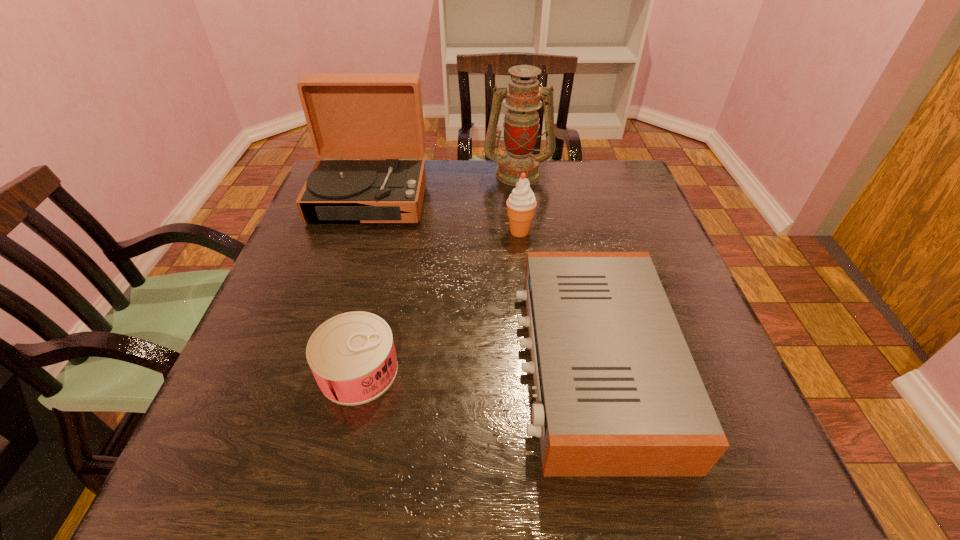
Image resolution: width=960 pixels, height=540 pixels. In order to click on free space located on the control panel of the radio receiver in this screenshot , I will do `click(427, 364)`.

Locate an element on the screen. The image size is (960, 540). vacant space located on the right of the shortest object is located at coordinates (576, 370).

This screenshot has height=540, width=960. Identify the location of oil lamp that is at the far edge. (521, 124).

The image size is (960, 540). I want to click on phonograph record located in the far edge section of the desktop, so pyautogui.click(x=349, y=116).

Locate an element on the screen. The height and width of the screenshot is (540, 960). object that is at the near edge is located at coordinates (617, 391).

The image size is (960, 540). Identify the location of phonograph record that is at the left edge. (349, 116).

Image resolution: width=960 pixels, height=540 pixels. Find the location of `can that is at the left edge`. can that is at the left edge is located at coordinates (352, 356).

You are a GUI agent. You are given a task and a screenshot of the screen. Output one action in this format:
    pyautogui.click(x=<x>, y=<y>)
    Task: Click on the object that is at the right edge
    The height and width of the screenshot is (540, 960).
    Given the screenshot: What is the action you would take?
    pyautogui.click(x=617, y=391)

I want to click on object that is at the far left corner, so click(x=349, y=116).

This screenshot has width=960, height=540. In order to click on object present at the near right corner in this screenshot , I will do `click(617, 391)`.